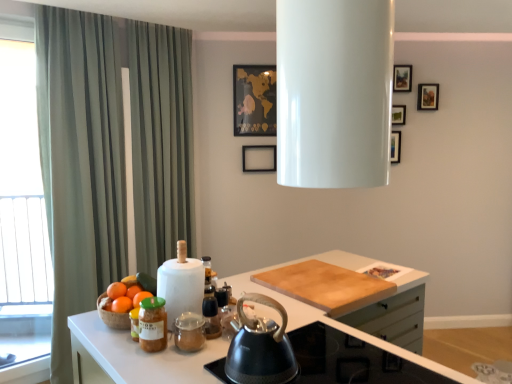
Describe the element at coordinates (141, 297) in the screenshot. I see `orangesmoothfruit at left, which ranks as the 1th orange in right-to-left order` at that location.

I want to click on orange matte at lower left, the 2th orange when ordered from left to right, so click(122, 304).

The height and width of the screenshot is (384, 512). I want to click on wooden picture frame at upper right, acting as the 4th picture frame starting from the left, so click(x=428, y=96).

I want to click on white glossy range hood at upper center, marked as the 1th appliance in a top-to-bottom arrangement, so click(x=334, y=92).

The height and width of the screenshot is (384, 512). What are the coordinates of `wooden picture frame at upper right, the 3th picture frame viewed from the left` in the screenshot? It's located at (402, 78).

Describe the element at coordinates (181, 284) in the screenshot. The image size is (512, 384). I see `white paper towel at center, which is the 2th appliance in front-to-back order` at that location.

Locate an element on the screen. green striped curtain at left is located at coordinates (80, 163).

Which is behind, point (4, 257) or point (165, 268)?

Positioned behind is point (4, 257).

From a real-world perspective, which object stands above the other?

white sheer curtain at left.

Is white sheer curtain at left next to white paper towel at center, which appears as the first appliance when viewed from the left, and touching it?

No, white sheer curtain at left is not making contact with white paper towel at center, which appears as the first appliance when viewed from the left.

Which point is more distant from viewer, (124, 290) or (153, 329)?

The point (124, 290) is more distant.

Is orangesmoothfruit at left, which is the first orange from left to right, inside the boundaries of matte glass jar at lower left, or outside?

orangesmoothfruit at left, which is the first orange from left to right, is not inside matte glass jar at lower left, it's outside.

Can you confirm if orangesmoothfruit at left, which is the third orange in right-to-left order, is positioned to the left of matte glass jar at lower left?

Indeed, orangesmoothfruit at left, which is the third orange in right-to-left order, is positioned on the left side of matte glass jar at lower left.

Between orangesmoothfruit at left, which is the first orange from left to right, and matte glass jar at lower left, which one has less height?

Standing shorter between the two is orangesmoothfruit at left, which is the first orange from left to right.

From a real-world perspective, which object stands above the other?

From a 3D spatial view, white paper towel at center, the second appliance viewed from the top, is above.

Between white paper towel at center, the second appliance viewed from the top, and orangesmoothfruit at left, which is the first orange from left to right, which one has more height?

Standing taller between the two is white paper towel at center, the second appliance viewed from the top.

From the orangesmoothfruit at left, which is the first orange from left to right, count 1st appliance to the right and point to it. Please provide its 2D coordinates.

[(181, 284)]

Could you measure the distance between white paper towel at center, which is the 2th appliance in front-to-back order, and orangesmoothfruit at left, which is the third orange in right-to-left order?

white paper towel at center, which is the 2th appliance in front-to-back order, and orangesmoothfruit at left, which is the third orange in right-to-left order, are 21.65 centimeters apart.

Is wooden picture frame at upper right, placed as the 1th picture frame when sorted from right to left, to the right of white sheer curtain at left from the viewer's perspective?

Indeed, wooden picture frame at upper right, placed as the 1th picture frame when sorted from right to left, is positioned on the right side of white sheer curtain at left.

Would you say white sheer curtain at left is part of wooden picture frame at upper right, placed as the 1th picture frame when sorted from right to left,'s contents?

That's incorrect, white sheer curtain at left is not inside wooden picture frame at upper right, placed as the 1th picture frame when sorted from right to left.

Can you see wooden picture frame at upper right, placed as the 1th picture frame when sorted from right to left, touching white sheer curtain at left?

No, wooden picture frame at upper right, placed as the 1th picture frame when sorted from right to left, is not beside white sheer curtain at left.

How different are the orientations of wooden picture frame at upper right, placed as the 1th picture frame when sorted from right to left, and white sheer curtain at left in degrees?

wooden picture frame at upper right, placed as the 1th picture frame when sorted from right to left, and white sheer curtain at left are facing 34.9 degrees away from each other.

In terms of size, does wooden picture frame at upper right, the second picture frame viewed from the right, appear bigger or smaller than white paper towel at center, positioned as the second appliance in right-to-left order?

Clearly, wooden picture frame at upper right, the second picture frame viewed from the right, is smaller in size than white paper towel at center, positioned as the second appliance in right-to-left order.

Which is closer to the camera, (x=403, y=68) or (x=186, y=253)?

The point (x=186, y=253) is closer to the camera.

Is the depth of wooden picture frame at upper right, the 3th picture frame viewed from the left, greater than that of white paper towel at center, the second appliance viewed from the top?

Yes, wooden picture frame at upper right, the 3th picture frame viewed from the left, is further from the viewer.

Considering the relative sizes of wooden picture frame at upper right, acting as the 4th picture frame starting from the left, and orangesmoothfruit at left, which ranks as the 1th orange in right-to-left order, in the image provided, is wooden picture frame at upper right, acting as the 4th picture frame starting from the left, taller than orangesmoothfruit at left, which ranks as the 1th orange in right-to-left order,?

Indeed, wooden picture frame at upper right, acting as the 4th picture frame starting from the left, has a greater height compared to orangesmoothfruit at left, which ranks as the 1th orange in right-to-left order.

Is wooden picture frame at upper right, placed as the 1th picture frame when sorted from right to left, far away from orangesmoothfruit at left, marked as the 3th orange in a left-to-right arrangement?

Yes.

Is wooden picture frame at upper right, acting as the 4th picture frame starting from the left, not inside orangesmoothfruit at left, which ranks as the 1th orange in right-to-left order?

Absolutely, wooden picture frame at upper right, acting as the 4th picture frame starting from the left, is external to orangesmoothfruit at left, which ranks as the 1th orange in right-to-left order.

From a real-world perspective, who is located higher, wooden picture frame at upper right, placed as the 1th picture frame when sorted from right to left, or orangesmoothfruit at left, which ranks as the 1th orange in right-to-left order?

wooden picture frame at upper right, placed as the 1th picture frame when sorted from right to left.

Is wooden picture frame at upper right, placed as the 1th picture frame when sorted from right to left, turned away from wooden picture frame at upper right, the second picture frame viewed from the right?

No, wooden picture frame at upper right, placed as the 1th picture frame when sorted from right to left, is not facing the opposite direction of wooden picture frame at upper right, the second picture frame viewed from the right.

Is wooden picture frame at upper right, placed as the 1th picture frame when sorted from right to left, inside the boundaries of wooden picture frame at upper right, the second picture frame viewed from the right, or outside?

wooden picture frame at upper right, placed as the 1th picture frame when sorted from right to left, is located beyond the bounds of wooden picture frame at upper right, the second picture frame viewed from the right.

The width and height of the screenshot is (512, 384). I want to click on window above the white paper towel at center, the second appliance viewed from the top (from the image's perspective), so click(x=21, y=203).

From a real-world perspective, which orange is the 3rd one above the matte glass jar at lower left? Please provide its 2D coordinates.

[(116, 290)]

Based on their spatial positions, is white sheer curtain at left or white glossy range hood at upper center, the 1th appliance viewed from the front, further from orangesmoothfruit at left, which is the first orange from left to right?

Among the two, white sheer curtain at left is located further to orangesmoothfruit at left, which is the first orange from left to right.

Based on their spatial positions, is gold paper map at upper center, marked as the fourth picture frame in a right-to-left arrangement, or black matte kettle at center closer to wooden picture frame at upper right, placed as the 1th picture frame when sorted from right to left?

gold paper map at upper center, marked as the fourth picture frame in a right-to-left arrangement, is positioned closer to the anchor wooden picture frame at upper right, placed as the 1th picture frame when sorted from right to left.

Looking at the image, which one is located further to white glossy countertop at lower left, wooden picture frame at upper right, placed as the 1th picture frame when sorted from right to left, or orange matte at left?

wooden picture frame at upper right, placed as the 1th picture frame when sorted from right to left, lies further to white glossy countertop at lower left than the other object.

When comparing their distances from orange matte at lower left, the 2th orange in the right-to-left sequence, does black matte picture frame at center, marked as the second picture frame in a left-to-right arrangement, or orangesmoothfruit at left, marked as the 3th orange in a left-to-right arrangement, seem further?

Based on the image, black matte picture frame at center, marked as the second picture frame in a left-to-right arrangement, appears to be further to orange matte at lower left, the 2th orange in the right-to-left sequence.

Consider the image. Estimate the real-world distances between objects in this image. Which object is closer to white glossy countertop at lower left, orange matte at lower left, the 2th orange in the right-to-left sequence, or black matte picture frame at center, which is the 3th picture frame in right-to-left order?

Based on the image, orange matte at lower left, the 2th orange in the right-to-left sequence, appears to be nearer to white glossy countertop at lower left.

Estimate the real-world distances between objects in this image. Which object is closer to gold paper map at upper center, which is the first picture frame in left-to-right order, green striped curtain at left or white glossy countertop at lower left?

green striped curtain at left lies closer to gold paper map at upper center, which is the first picture frame in left-to-right order, than the other object.

Considering their positions, is wooden picture frame at upper right, acting as the 4th picture frame starting from the left, positioned closer to black matte kettle at center than white sheer curtain at left?

Among the two, white sheer curtain at left is located nearer to black matte kettle at center.

When comparing their distances from orangesmoothfruit at left, which is the third orange in right-to-left order, does matte glass jar at lower left or orangesmoothfruit at left, marked as the 3th orange in a left-to-right arrangement, seem further?

Among the two, matte glass jar at lower left is located further to orangesmoothfruit at left, which is the third orange in right-to-left order.

I want to click on appliance situated between white sheer curtain at left and white glossy countertop at lower left from left to right, so click(181, 284).

Where is `appliance between white glossy countertop at lower left and wooden picture frame at upper right, the 3th picture frame viewed from the left, from front to back`? The width and height of the screenshot is (512, 384). appliance between white glossy countertop at lower left and wooden picture frame at upper right, the 3th picture frame viewed from the left, from front to back is located at coordinates (181, 284).

I want to click on appliance that lies between white glossy range hood at upper center, placed as the first appliance when sorted from right to left, and white glossy countertop at lower left from top to bottom, so click(x=181, y=284).

The width and height of the screenshot is (512, 384). Identify the location of picture frame between black matte picture frame at center, marked as the second picture frame in a left-to-right arrangement, and wooden picture frame at upper right, acting as the 4th picture frame starting from the left. (402, 78).